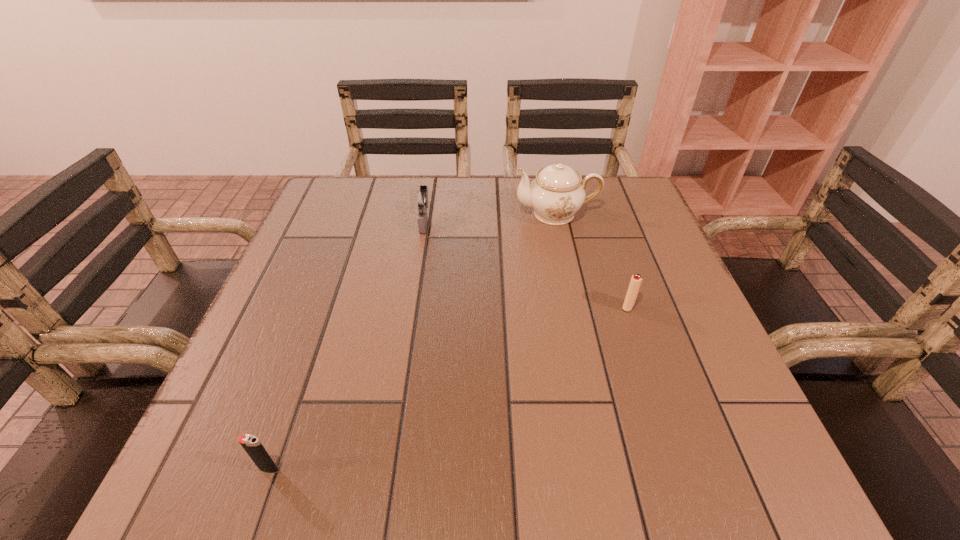
Identify which igniter is the second nearest to the second nearest object. Please provide its 2D coordinates. Your answer should be formatted as a tuple, i.e. [(x, y)], where the tuple contains the x and y coordinates of a point satisfying the conditions above.

[(251, 444)]

You are a GUI agent. You are given a task and a screenshot of the screen. Output one action in this format:
    pyautogui.click(x=<x>, y=<y>)
    Task: Click on the free space that satisfies the following two spatial constraints: 1. on the back side of the third farthest object; 2. at the spout of the chinaware
    Image resolution: width=960 pixels, height=540 pixels.
    Given the screenshot: What is the action you would take?
    pyautogui.click(x=597, y=214)

This screenshot has width=960, height=540. Find the location of `vacant space that satisfies the following two spatial constraints: 1. at the spout of the chinaware; 2. on the front side of the leftmost object`. vacant space that satisfies the following two spatial constraints: 1. at the spout of the chinaware; 2. on the front side of the leftmost object is located at coordinates (612, 469).

You are a GUI agent. You are given a task and a screenshot of the screen. Output one action in this format:
    pyautogui.click(x=<x>, y=<y>)
    Task: Click on the free space that satisfies the following two spatial constraints: 1. at the spout of the second nearest igniter; 2. on the right side of the tallest object
    This screenshot has width=960, height=540.
    Given the screenshot: What is the action you would take?
    pyautogui.click(x=576, y=307)

What are the coordinates of `vacant space that satisfies the following two spatial constraints: 1. on the front side of the third shortest object; 2. on the left side of the rightmost igniter` in the screenshot? It's located at (412, 307).